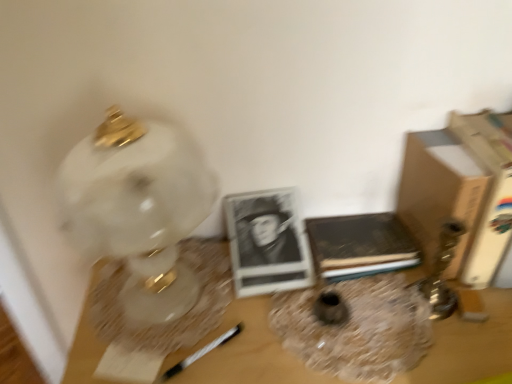
Question: Does brown leather book at center, which ranks as the 1th paperback book in left-to-right order, come behind translucent glass vase at center, which is counted as the first vase, starting from the right?

Choices:
 (A) no
 (B) yes

Answer: (B)

Question: Is brown leather book at center, positioned as the 2th paperback book in right-to-left order, not near translucent glass vase at center, acting as the second vase starting from the left?

Choices:
 (A) yes
 (B) no

Answer: (B)

Question: From a real-world perspective, is brown leather book at center, which ranks as the 1th paperback book in left-to-right order, over translucent glass vase at center, acting as the second vase starting from the left?

Choices:
 (A) yes
 (B) no

Answer: (A)

Question: Is brown leather book at center, which ranks as the 1th paperback book in left-to-right order, smaller than translucent glass vase at center, which is counted as the first vase, starting from the right?

Choices:
 (A) no
 (B) yes

Answer: (B)

Question: From the image's perspective, does brown leather book at center, which ranks as the 1th paperback book in left-to-right order, appear lower than translucent glass vase at center, which is counted as the first vase, starting from the right?

Choices:
 (A) yes
 (B) no

Answer: (B)

Question: Can you confirm if brown leather book at center, positioned as the 2th paperback book in right-to-left order, is taller than translucent glass vase at center, acting as the second vase starting from the left?

Choices:
 (A) no
 (B) yes

Answer: (B)

Question: Is brown cardboard box at right to the left of brown cardboard book at right, which is the 1th paperback book from right to left, from the viewer's perspective?

Choices:
 (A) no
 (B) yes

Answer: (B)

Question: Does brown cardboard box at right appear on the right side of brown cardboard book at right, the 2th paperback book from the left?

Choices:
 (A) no
 (B) yes

Answer: (A)

Question: Can you confirm if brown cardboard box at right is thinner than brown cardboard book at right, which is the 1th paperback book from right to left?

Choices:
 (A) no
 (B) yes

Answer: (B)

Question: From a real-world perspective, is brown cardboard box at right physically below brown cardboard book at right, which is the 1th paperback book from right to left?

Choices:
 (A) no
 (B) yes

Answer: (B)

Question: Is brown cardboard box at right further to camera compared to brown cardboard book at right, which is the 1th paperback book from right to left?

Choices:
 (A) no
 (B) yes

Answer: (B)

Question: Is brown cardboard box at right in contact with brown cardboard book at right, which is the 1th paperback book from right to left?

Choices:
 (A) yes
 (B) no

Answer: (A)

Question: Is matte glass vase at center, which ranks as the 1th vase in left-to-right order, next to wooden table at center and touching it?

Choices:
 (A) no
 (B) yes

Answer: (A)